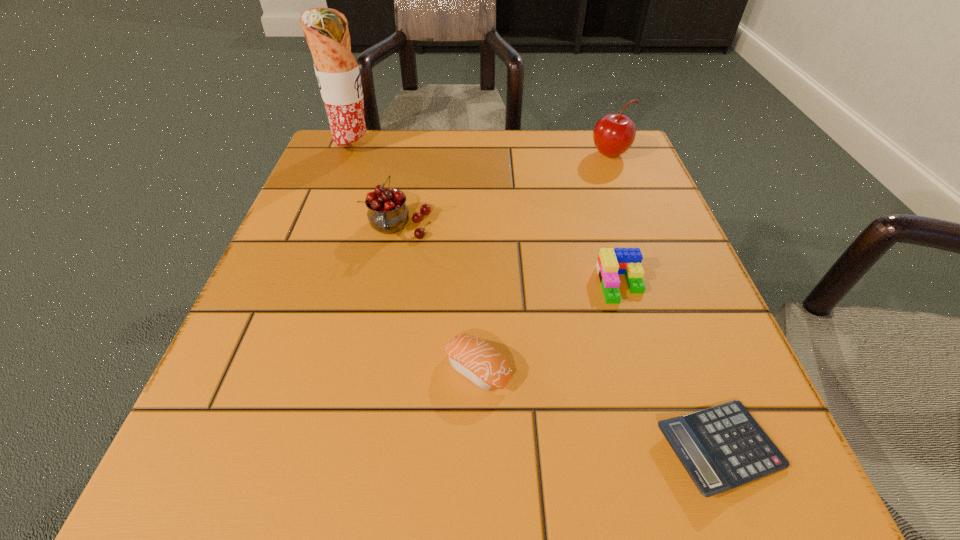
Locate an element on the screen. vacant space located on the right of the leftmost object is located at coordinates (413, 148).

This screenshot has width=960, height=540. I want to click on blank area located on the left of the farther cherry, so click(443, 154).

Where is `vacant space located 0.140m on the handle side of the third farthest object`? vacant space located 0.140m on the handle side of the third farthest object is located at coordinates (383, 309).

In order to click on vacant region located on the front of the third nearest object in this screenshot , I will do `click(653, 390)`.

Where is `free location located on the left of the sushi`? free location located on the left of the sushi is located at coordinates (386, 368).

At what (x,y) coordinates should I click in order to perform the action: click on free space located 0.330m on the back of the nearest object. Please return your answer as a coordinate pair (x, y). The height and width of the screenshot is (540, 960). Looking at the image, I should click on (637, 235).

Find the location of `burrito located in the far edge section of the desktop`. burrito located in the far edge section of the desktop is located at coordinates (326, 30).

Identify the location of cherry positioned at the far edge. (613, 134).

Locate an element on the screen. This screenshot has width=960, height=540. object that is at the near edge is located at coordinates (722, 447).

At what (x,y) coordinates should I click in order to perform the action: click on burrito at the left edge. Please return your answer as a coordinate pair (x, y). This screenshot has height=540, width=960. Looking at the image, I should click on point(326,30).